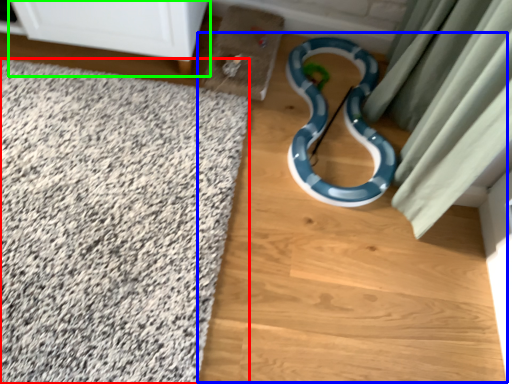
Question: Based on their relative distances, which object is farther from bath mat (highlighted by a red box)? Choose from dirt track (highlighted by a blue box) and furniture (highlighted by a green box).

Choices:
 (A) dirt track
 (B) furniture

Answer: (B)